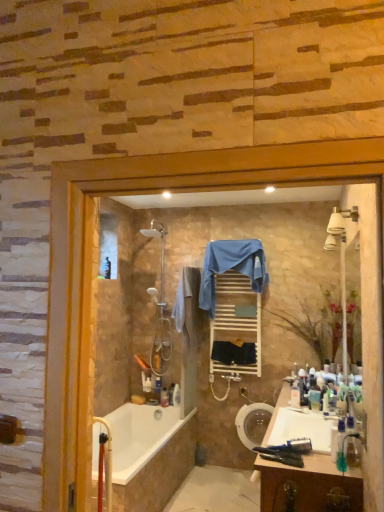
Question: Does point (167, 406) appear closer or farther from the camera than point (210, 371)?

Choices:
 (A) farther
 (B) closer

Answer: (A)

Question: From a real-world perspective, is translucent plastic bottle at lower center, marked as the fourth toiletry in a top-to-bottom arrangement, above or below white wooden towel rack at center?

Choices:
 (A) above
 (B) below

Answer: (B)

Question: Estimate the real-world distances between objects in this image. Which object is closer to the beige cotton bath towel at center, acting as the 3th bath towel starting from the right?

Choices:
 (A) white wooden towel rack at center
 (B) wooden cabinet at lower right
 (C) white glossy bathtub at lower left
 (D) dark blue fabric at center, positioned as the first bath towel in right-to-left order
 (E) blue fabric towel at center, placed as the 2th bath towel when sorted from left to right

Answer: (E)

Question: Estimate the real-world distances between objects in this image. Which object is farther from the translucent plastic bottle at lower center, the 1th toiletry viewed from the left?

Choices:
 (A) white wooden towel rack at center
 (B) dark blue fabric at center, marked as the 3th bath towel in a left-to-right arrangement
 (C) polished chrome shower at center
 (D) blue fabric towel at center, which ranks as the 2th bath towel in right-to-left order
 (E) white glossy bathtub at lower left

Answer: (D)